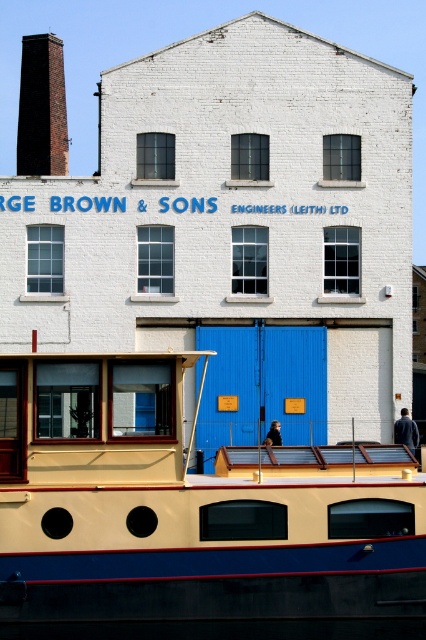
You are standing in front of the two story white brick building with a pitched roof. You see a point marked at coordinates (189,516). What object is located at that point?

The point at (189,516) marks the beige wood boat at center.

You are standing in front of the two story white brick building with the chimney. You want to board the beige wood boat at center. Which direction should you walk to reach the boat?

The beige wood boat at center is located at point (189, 516), so you should walk forward to reach it since it is in front of you.